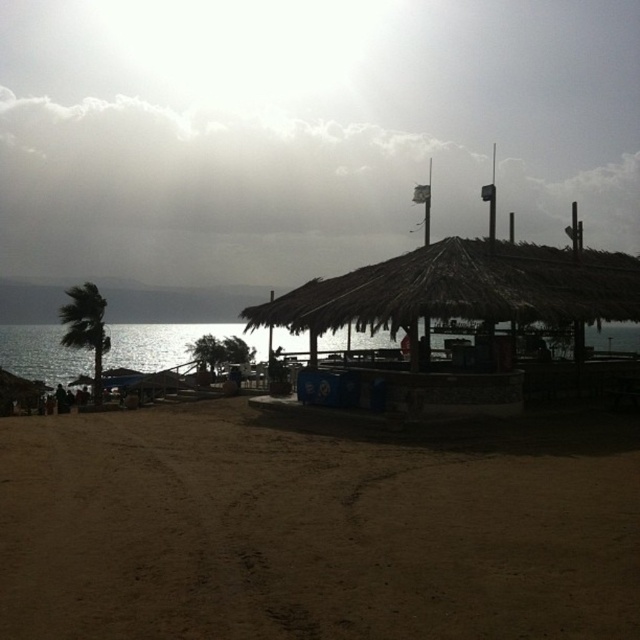
Question: Does shiny blue water at lower left appear on the left side of green leafy palm tree at left?

Choices:
 (A) no
 (B) yes

Answer: (A)

Question: Does brown sandy beach at lower left have a larger size compared to green leafy palm tree at left?

Choices:
 (A) yes
 (B) no

Answer: (B)

Question: Estimate the real-world distances between objects in this image. Which object is farther from the green leafy palm tree at left?

Choices:
 (A) brown sandy beach at lower left
 (B) shiny blue water at lower left

Answer: (A)

Question: Which point is closer to the camera taking this photo?

Choices:
 (A) (0, 330)
 (B) (157, 461)
 (C) (61, 317)

Answer: (B)

Question: Does brown sandy beach at lower left appear on the right side of shiny blue water at lower left?

Choices:
 (A) no
 (B) yes

Answer: (B)

Question: Based on their relative distances, which object is farther from the shiny blue water at lower left?

Choices:
 (A) green leafy palm tree at left
 (B) brown sandy beach at lower left

Answer: (B)